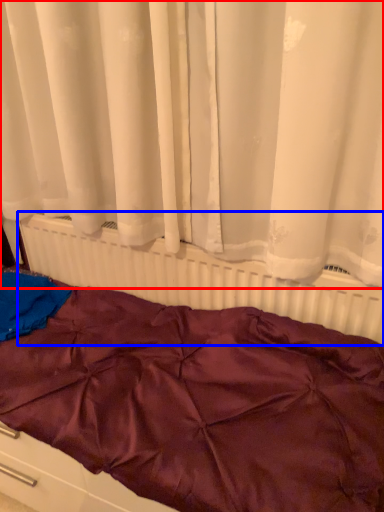
Question: Among these objects, which one is nearest to the camera, curtain (highlighted by a red box) or radiator (highlighted by a blue box)?

Choices:
 (A) curtain
 (B) radiator

Answer: (A)